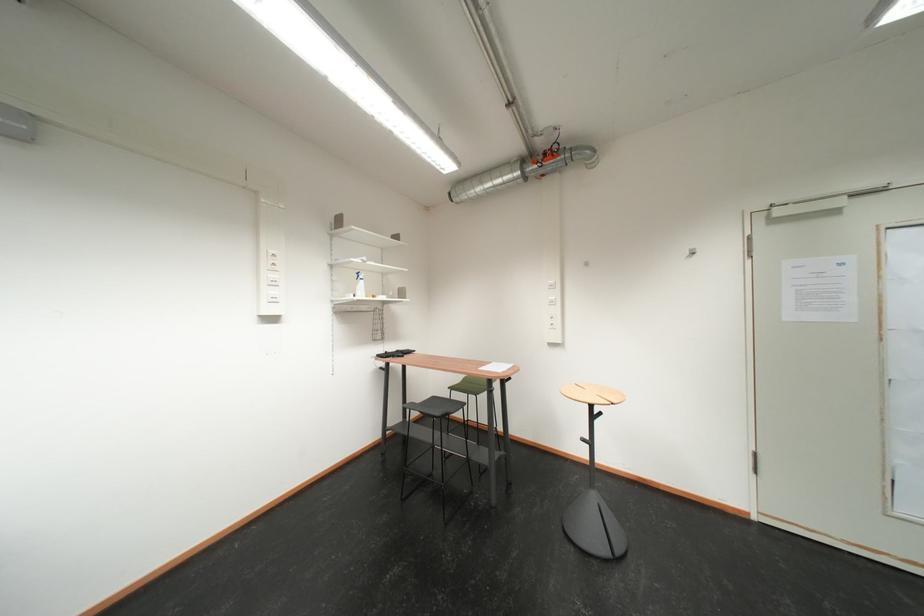
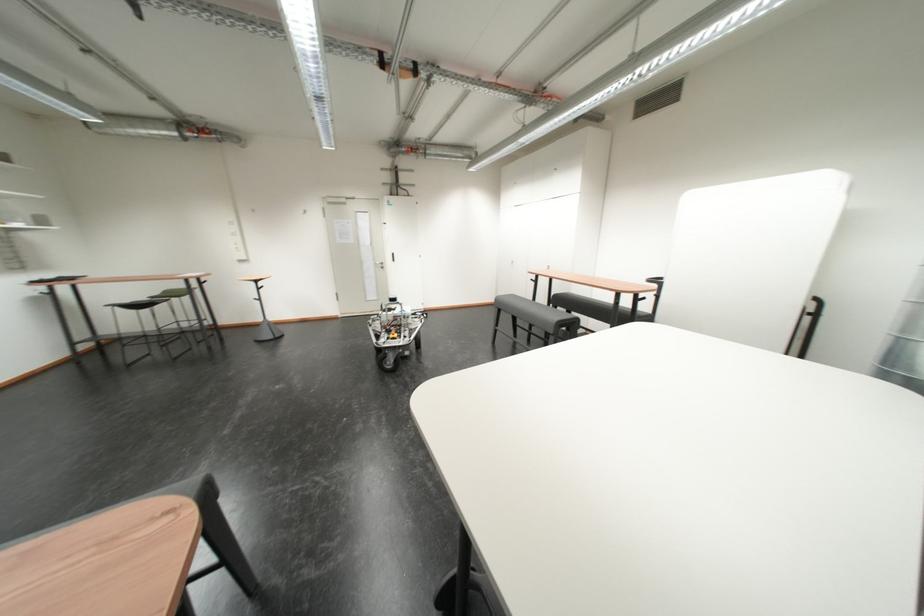
Find the pixel in the second image that matches [459,390] in the first image.

(160, 300)